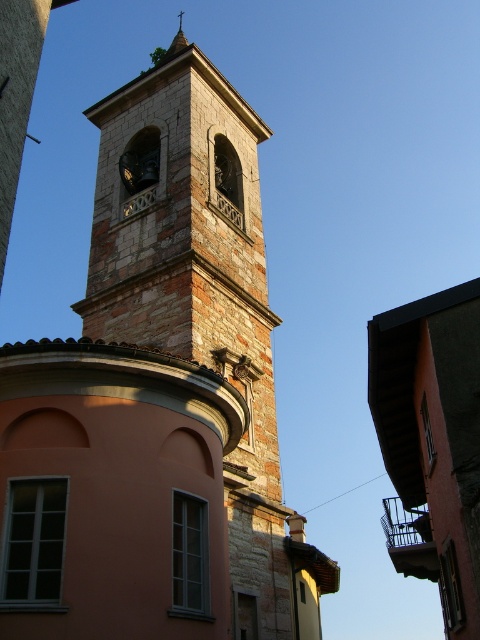
Does stone bell tower at center appear over smooth stone spire at upper center?

No.

Is stone bell tower at center taller than smooth stone spire at upper center?

No.

Is point (124, 193) closer to camera compared to point (178, 49)?

That is True.

This screenshot has height=640, width=480. What are the coordinates of `stone bell tower at center` in the screenshot? It's located at (157, 397).